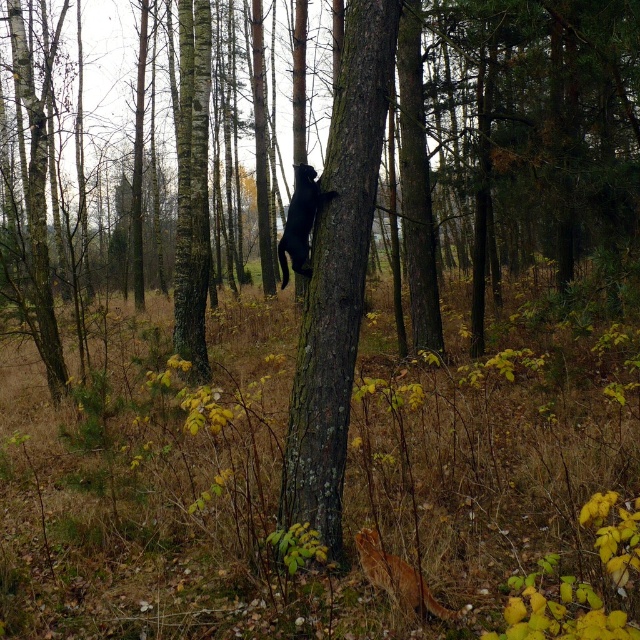
Does smooth bark tree at center have a larger size compared to shiny black cat at center?

Yes.

Is point (307, 332) in front of point (301, 221)?

Yes, it is.

Find the location of a particular element. smooth bark tree at center is located at coordinates (339, 275).